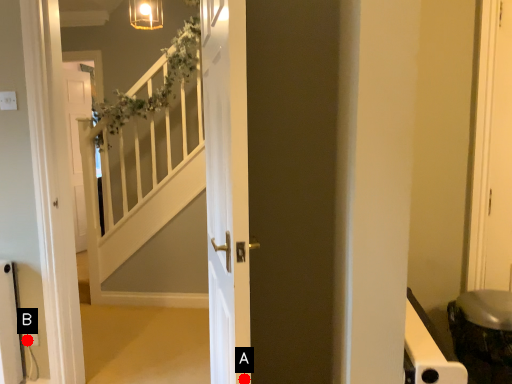
Question: Two points are circled on the image, labeled by A and B beside each circle. Which point is farther from the camera taking this photo?

Choices:
 (A) A is further
 (B) B is further

Answer: (B)